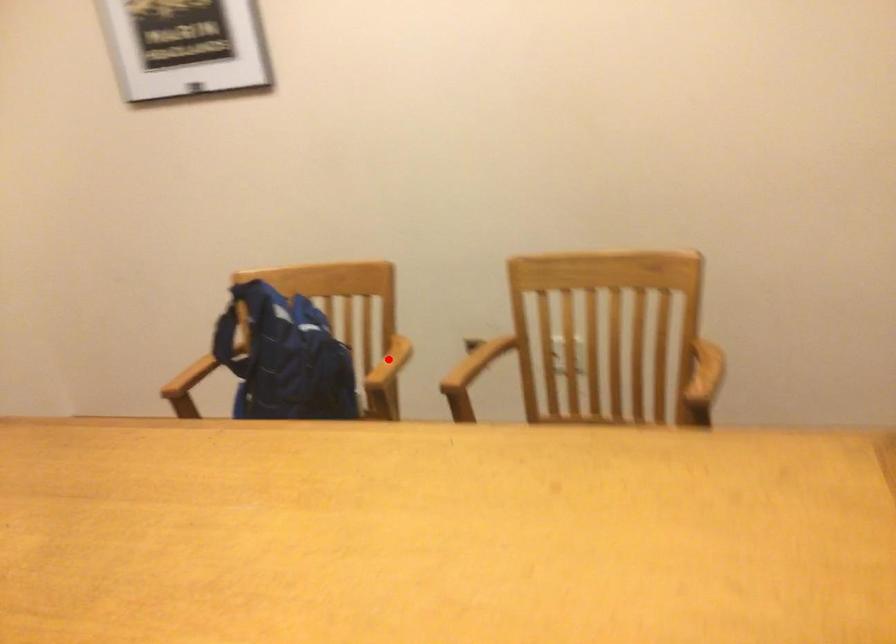
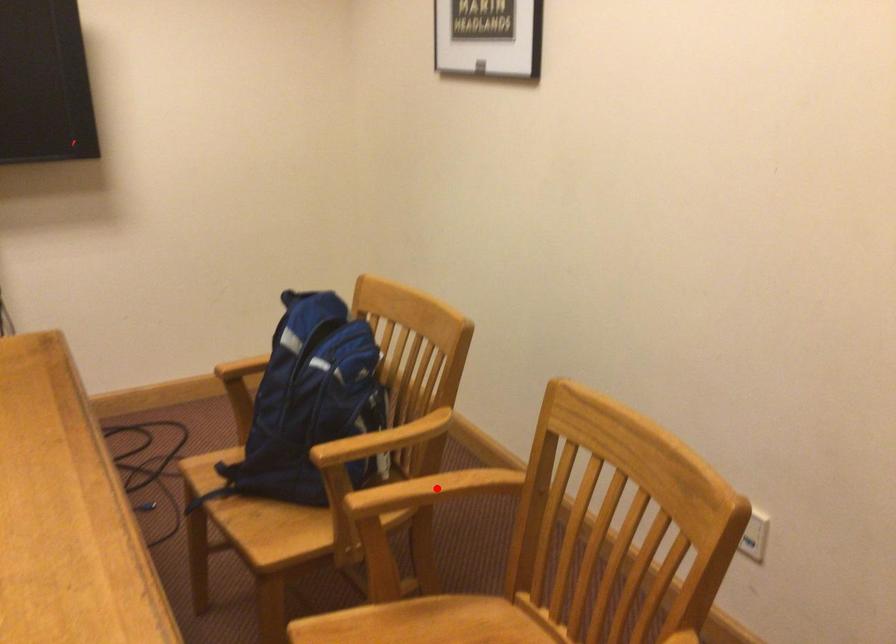
I am providing you with two images of the same scene from different viewpoints. A red point is marked on the first image and another point is marked on the second image. Do the highlighted points in image1 and image2 indicate the same real-world spot?

No